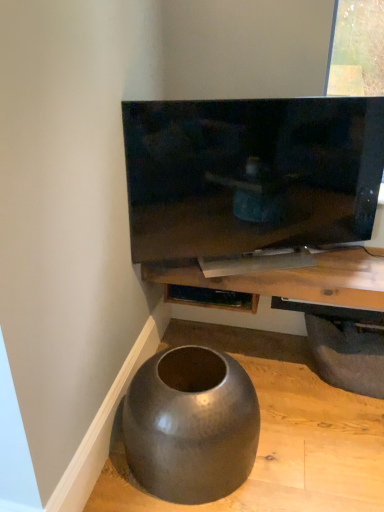
Where is `free space in front of dark gray rubber tire at lower right`? free space in front of dark gray rubber tire at lower right is located at coordinates (337, 426).